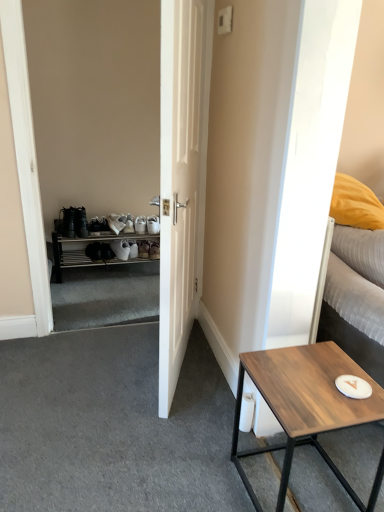
Question: From the image's perspective, is white matte door at center located beneath white plastic shoe rack at left?

Choices:
 (A) no
 (B) yes

Answer: (A)

Question: Considering the relative positions of white matte door at center and white plastic shoe rack at left in the image provided, is white matte door at center behind white plastic shoe rack at left?

Choices:
 (A) yes
 (B) no

Answer: (B)

Question: From a real-world perspective, is white matte door at center positioned under white plastic shoe rack at left based on gravity?

Choices:
 (A) no
 (B) yes

Answer: (A)

Question: Is white plastic shoe rack at left inside white matte door at center?

Choices:
 (A) yes
 (B) no

Answer: (B)

Question: From the image's perspective, would you say white matte door at center is positioned over white plastic shoe rack at left?

Choices:
 (A) yes
 (B) no

Answer: (A)

Question: Considering the relative sizes of white matte door at center and white plastic shoe rack at left in the image provided, is white matte door at center smaller than white plastic shoe rack at left?

Choices:
 (A) no
 (B) yes

Answer: (A)

Question: Is there a large distance between wooden table at lower right and white textured bed at right?

Choices:
 (A) no
 (B) yes

Answer: (A)

Question: Is white textured bed at right completely or partially inside wooden table at lower right?

Choices:
 (A) yes
 (B) no

Answer: (B)

Question: Can you confirm if wooden table at lower right is shorter than white textured bed at right?

Choices:
 (A) yes
 (B) no

Answer: (B)

Question: Is the depth of wooden table at lower right greater than that of white textured bed at right?

Choices:
 (A) yes
 (B) no

Answer: (B)

Question: From a real-world perspective, is wooden table at lower right located beneath white textured bed at right?

Choices:
 (A) yes
 (B) no

Answer: (A)

Question: Is wooden table at lower right in front of white textured bed at right?

Choices:
 (A) yes
 (B) no

Answer: (A)

Question: From a real-world perspective, is white textured bed at right on wooden table at lower right?

Choices:
 (A) no
 (B) yes

Answer: (B)